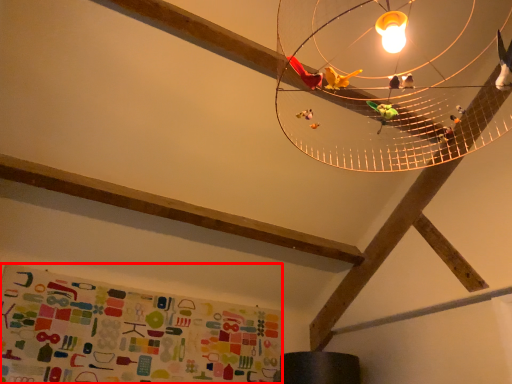
Question: In this image, where is bulletin board (annotated by the red box) located relative to lamp?

Choices:
 (A) left
 (B) right

Answer: (A)